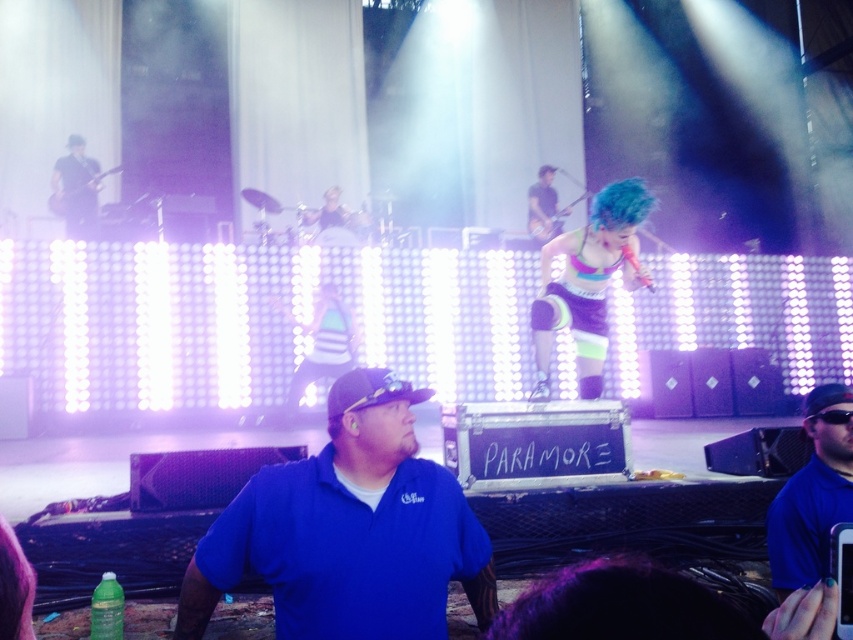
Does neon blue hair at center appear under blue shirt at lower right?

No, neon blue hair at center is not below blue shirt at lower right.

Is point (619, 252) less distant than point (805, 435)?

No.

Locate an element on the screen. The height and width of the screenshot is (640, 853). neon blue hair at center is located at coordinates coord(589,282).

Who is lower down, blue cotton shirt at center or blue shirt at lower right?

blue shirt at lower right

Is blue cotton shirt at center above blue shirt at lower right?

Indeed, blue cotton shirt at center is positioned over blue shirt at lower right.

Which is behind, point (392, 564) or point (836, 410)?

The point (836, 410) is more distant.

Identify the location of blue cotton shirt at center. The image size is (853, 640). (349, 531).

Which is behind, point (395, 426) or point (54, 182)?

Positioned behind is point (54, 182).

Is point (397, 541) positioned before point (96, 208)?

Yes, point (397, 541) is in front of point (96, 208).

Locate an element on the screen. This screenshot has height=640, width=853. blue cotton shirt at center is located at coordinates (349, 531).